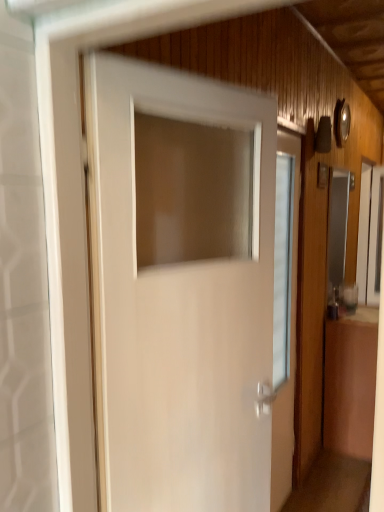
What do you see at coordinates (177, 311) in the screenshot? This screenshot has height=512, width=384. I see `white glossy door at center` at bounding box center [177, 311].

You are a GUI agent. You are given a task and a screenshot of the screen. Output one action in this format:
    pyautogui.click(x=<x>, y=<y>)
    Task: Click on the white glossy door at center
    
    Given the screenshot: What is the action you would take?
    pyautogui.click(x=177, y=311)

Image resolution: width=384 pixels, height=512 pixels. What do you see at coordinates (370, 234) in the screenshot?
I see `clear glass window at right` at bounding box center [370, 234].

I want to click on clear glass window at right, so click(370, 234).

The width and height of the screenshot is (384, 512). I want to click on white glossy door at center, so click(177, 311).

Which object is positioned more to the right, white glossy door at center or clear glass window at right?

clear glass window at right is more to the right.

Which object is further away from the camera taking this photo, white glossy door at center or clear glass window at right?

Positioned behind is clear glass window at right.

Is point (169, 411) positioned after point (366, 284)?

No, (169, 411) is closer to viewer.

From the image's perspective, relative to clear glass window at right, is white glossy door at center above or below?

white glossy door at center is below clear glass window at right.

From a real-world perspective, is white glossy door at center positioned above or below clear glass window at right?

From a real-world perspective, white glossy door at center is physically below clear glass window at right.

Which of these two, white glossy door at center or clear glass window at right, is thinner?

clear glass window at right.

Considering the relative sizes of white glossy door at center and clear glass window at right in the image provided, is white glossy door at center shorter than clear glass window at right?

In fact, white glossy door at center may be taller than clear glass window at right.

Does white glossy door at center have a smaller size compared to clear glass window at right?

Indeed, white glossy door at center has a smaller size compared to clear glass window at right.

Is white glossy door at center positioned beyond the bounds of clear glass window at right?

Indeed, white glossy door at center is completely outside clear glass window at right.

Is white glossy door at center placed right next to clear glass window at right?

No, white glossy door at center is not in contact with clear glass window at right.

Is white glossy door at center oriented towards clear glass window at right?

No, white glossy door at center is not facing towards clear glass window at right.

How different are the orientations of white glossy door at center and clear glass window at right in degrees?

21.1 degrees.

At what (x,y) coordinates should I click in order to perform the action: click on door that is on the left side of clear glass window at right. Please return your answer as a coordinate pair (x, y). The height and width of the screenshot is (512, 384). Looking at the image, I should click on [177, 311].

Between clear glass window at right and white glossy door at center, which one appears on the right side from the viewer's perspective?

clear glass window at right is more to the right.

Which object is further away from the camera taking this photo, clear glass window at right or white glossy door at center?

clear glass window at right is more distant.

Is point (378, 175) more distant than point (261, 233)?

That is True.

From the image's perspective, which one is positioned lower, clear glass window at right or white glossy door at center?

white glossy door at center appears lower in the image.

From a real-world perspective, which object rests below the other?

white glossy door at center is physically lower.

Does clear glass window at right have a lesser width compared to white glossy door at center?

Yes.

Considering the sizes of objects clear glass window at right and white glossy door at center in the image provided, who is taller, clear glass window at right or white glossy door at center?

white glossy door at center.

In terms of size, does clear glass window at right appear bigger or smaller than white glossy door at center?

clear glass window at right is bigger than white glossy door at center.

Would you say clear glass window at right is outside white glossy door at center?

clear glass window at right lies outside white glossy door at center's area.

Is clear glass window at right with white glossy door at center?

No, clear glass window at right is not making contact with white glossy door at center.

Is clear glass window at right aimed at white glossy door at center?

No.

How distant is clear glass window at right from white glossy door at center?

The distance of clear glass window at right from white glossy door at center is 7.40 feet.

The width and height of the screenshot is (384, 512). In order to click on door directly beneath the clear glass window at right (from a real-world perspective) in this screenshot , I will do `click(177, 311)`.

Identify the location of window behind the white glossy door at center. The width and height of the screenshot is (384, 512). (370, 234).

Locate an element on the screen. The width and height of the screenshot is (384, 512). door that appears on the left of clear glass window at right is located at coordinates (177, 311).